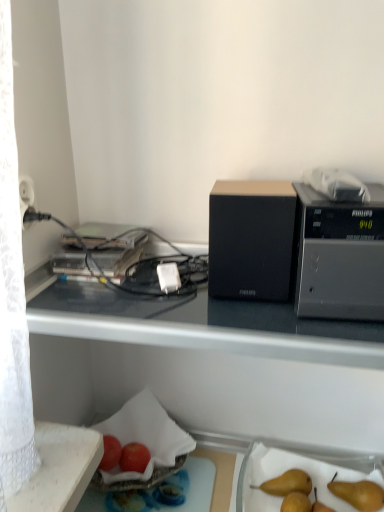
Question: Does black plastic microwave at upper right, positioned as the second appliance in left-to-right order, have a greater height compared to brown matte pear at lower right?

Choices:
 (A) yes
 (B) no

Answer: (A)

Question: Is the depth of black plastic microwave at upper right, positioned as the second appliance in left-to-right order, greater than that of brown matte pear at lower right?

Choices:
 (A) yes
 (B) no

Answer: (B)

Question: From the image's perspective, is black plastic microwave at upper right, the first appliance positioned from the right, located beneath brown matte pear at lower right?

Choices:
 (A) no
 (B) yes

Answer: (A)

Question: From a real-world perspective, does black plastic microwave at upper right, the first appliance positioned from the right, sit lower than brown matte pear at lower right?

Choices:
 (A) no
 (B) yes

Answer: (A)

Question: Can brown matte pear at lower right be found inside black plastic microwave at upper right, positioned as the second appliance in left-to-right order?

Choices:
 (A) yes
 (B) no

Answer: (B)

Question: Is there a large distance between black plastic microwave at upper right, positioned as the second appliance in left-to-right order, and brown matte pear at lower right?

Choices:
 (A) yes
 (B) no

Answer: (B)

Question: From a real-world perspective, is white plastic power plug at center positioned over black fabric speaker at center, the 2th appliance viewed from the right, based on gravity?

Choices:
 (A) yes
 (B) no

Answer: (B)

Question: Can you confirm if white plastic power plug at center is wider than black fabric speaker at center, the 2th appliance viewed from the right?

Choices:
 (A) no
 (B) yes

Answer: (A)

Question: Are white plastic power plug at center and black fabric speaker at center, the 2th appliance viewed from the right, far apart?

Choices:
 (A) yes
 (B) no

Answer: (B)

Question: Does white plastic power plug at center have a larger size compared to black fabric speaker at center, which is the first appliance in left-to-right order?

Choices:
 (A) yes
 (B) no

Answer: (B)

Question: Considering the relative sizes of white plastic power plug at center and black fabric speaker at center, which is the first appliance in left-to-right order, in the image provided, is white plastic power plug at center taller than black fabric speaker at center, which is the first appliance in left-to-right order,?

Choices:
 (A) yes
 (B) no

Answer: (B)

Question: Does white plastic power plug at center have a smaller size compared to black fabric speaker at center, the 2th appliance viewed from the right?

Choices:
 (A) no
 (B) yes

Answer: (B)

Question: Is white plastic power plug at center not within black matte desk at upper center?

Choices:
 (A) no
 (B) yes

Answer: (A)